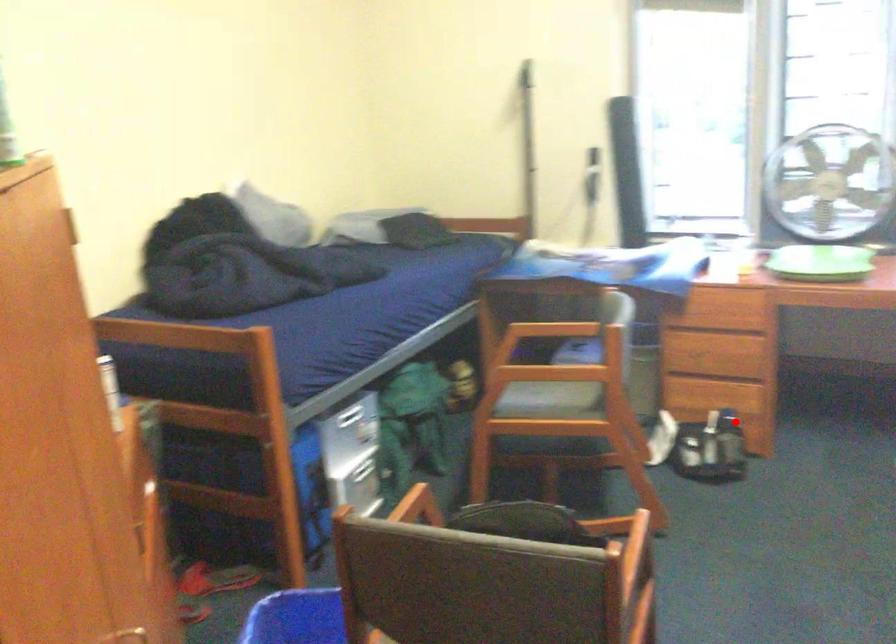
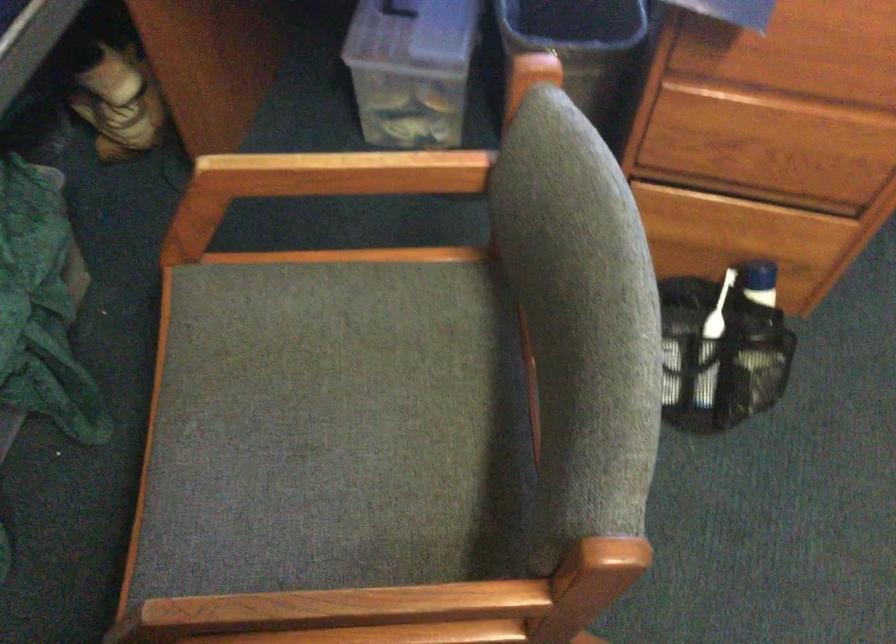
Question: I am providing you with two images of the same scene from different viewpoints. Given a red point in image1, look at the same physical point in image2. Is it:

Choices:
 (A) Closer to the viewpoint
 (B) Farther from the viewpoint

Answer: (A)